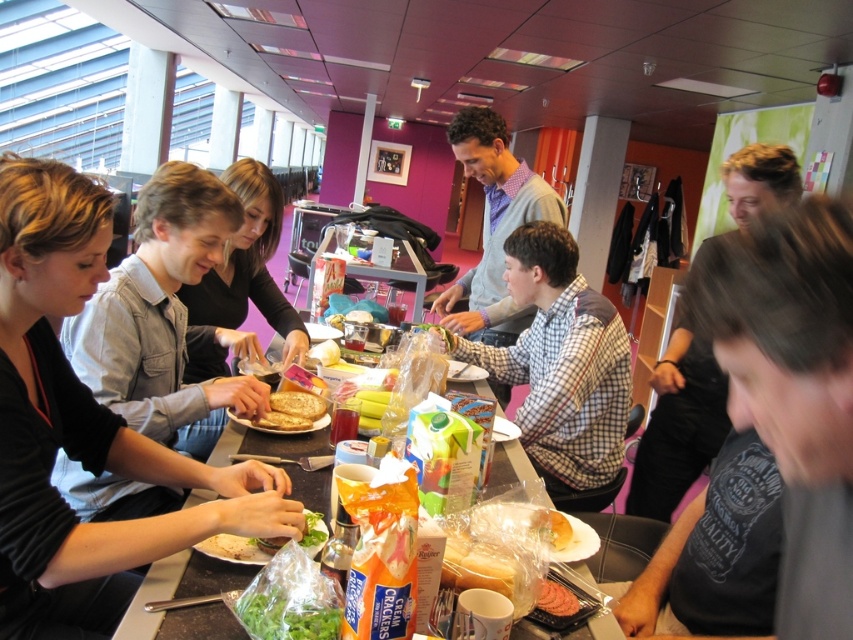
Can you confirm if white bread at center is positioned to the left of yellow crumbly cheese at center?

Yes, white bread at center is to the left of yellow crumbly cheese at center.

Does point (287, 422) come farther from viewer compared to point (552, 544)?

That is True.

This screenshot has height=640, width=853. Find the location of `white bread at center`. white bread at center is located at coordinates click(x=282, y=420).

Locate an element on the screen. This screenshot has width=853, height=640. white bread at center is located at coordinates coord(282,420).

Which is behind, point (317, 516) or point (555, 532)?

The point (555, 532) is behind.

Can you confirm if green leafy salad at center is positioned to the right of yellow crumbly cheese at center?

In fact, green leafy salad at center is to the left of yellow crumbly cheese at center.

Between point (299, 540) and point (552, 536), which one is positioned behind?

Positioned behind is point (552, 536).

Identify the location of green leafy salad at center. (312, 531).

Can you confirm if black cotton shirt at right is thinner than gray sweater at center?

Indeed, black cotton shirt at right has a lesser width compared to gray sweater at center.

Does black cotton shirt at right have a smaller size compared to gray sweater at center?

Yes, black cotton shirt at right is smaller than gray sweater at center.

Is point (752, 308) farther from camera compared to point (480, 288)?

No, (752, 308) is in front of (480, 288).

Identify the location of black cotton shirt at right. The width and height of the screenshot is (853, 640). (792, 387).